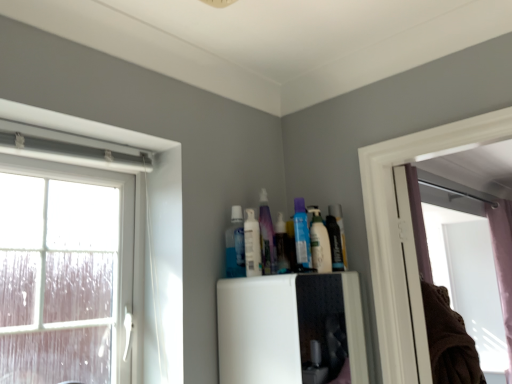
Question: From a real-world perspective, is brown cotton laundry at right physically located above or below translucent plastic bottle at upper center, arranged as the fourth toiletry when viewed from the left?

Choices:
 (A) above
 (B) below

Answer: (B)

Question: Would you say brown cotton laundry at right is inside or outside translucent plastic bottle at upper center, arranged as the fourth toiletry when viewed from the left?

Choices:
 (A) outside
 (B) inside

Answer: (A)

Question: Which object is positioned closest to the clear glass window at left?

Choices:
 (A) translucent purple bottle at upper center, which is the third toiletry in left-to-right order
 (B) white glossy lotion at upper center, positioned as the second toiletry in left-to-right order
 (C) brown cotton laundry at right
 (D) translucent plastic bottle at upper center, marked as the 2th toiletry in a right-to-left arrangement
 (E) translucent plastic toothpaste at upper center, the fifth toiletry positioned from the right

Answer: (E)

Question: Which of these objects is positioned farthest from the translucent plastic bottle at upper center, arranged as the fourth toiletry when viewed from the left?

Choices:
 (A) translucent plastic toothpaste at upper center, the fifth toiletry positioned from the right
 (B) translucent purple bottle at upper center, acting as the 3th toiletry starting from the right
 (C) brown cotton laundry at right
 (D) white glossy lotion at upper center, positioned as the second toiletry in left-to-right order
 (E) clear glass window at left

Answer: (C)